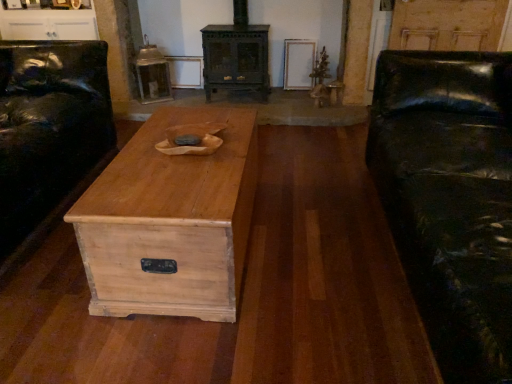
Where is `empty space that is ontop of natural wood chest at center`? Image resolution: width=512 pixels, height=384 pixels. empty space that is ontop of natural wood chest at center is located at coordinates coord(176,160).